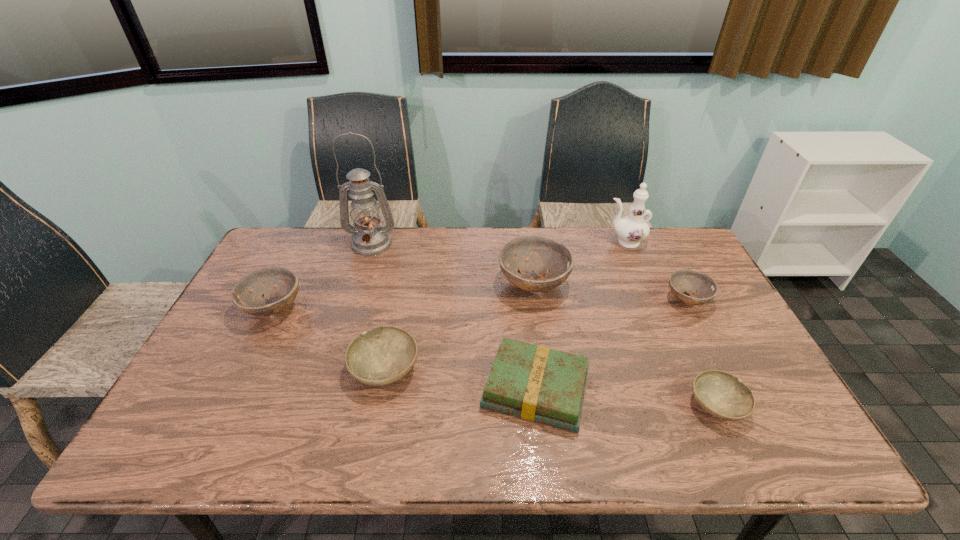
You are a GUI agent. You are given a task and a screenshot of the screen. Output one action in this format:
    pyautogui.click(x=<x>, y=<y>)
    Task: Click on the second closest brown bowl to the rightmost brown bowl
    
    Given the screenshot: What is the action you would take?
    pyautogui.click(x=246, y=294)

The height and width of the screenshot is (540, 960). Identify the location of brown bowl object that ranks as the second closest to the rightmost brown bowl. (246, 294).

Where is `vacant space that satisfies the following two spatial constraints: 1. on the back side of the shortest object; 2. at the spout of the seventh shortest object`? This screenshot has width=960, height=540. vacant space that satisfies the following two spatial constraints: 1. on the back side of the shortest object; 2. at the spout of the seventh shortest object is located at coordinates (641, 242).

The height and width of the screenshot is (540, 960). Identify the location of vacant area that satisfies the following two spatial constraints: 1. on the front side of the book; 2. on the left side of the leftmost brown bowl. (233, 389).

At what (x,y) coordinates should I click in order to perform the action: click on vacant space that satisfies the following two spatial constraints: 1. on the back side of the smallest brown bowl; 2. on the left side of the fourth bowl from right to left. Please return your answer as a coordinate pair (x, y). Image resolution: width=960 pixels, height=540 pixels. Looking at the image, I should click on (398, 300).

Where is `vacant space that satisfies the following two spatial constraints: 1. on the front side of the bigger gray bowl; 2. on the left side of the yellow book`? The height and width of the screenshot is (540, 960). vacant space that satisfies the following two spatial constraints: 1. on the front side of the bigger gray bowl; 2. on the left side of the yellow book is located at coordinates (381, 389).

Locate an element on the screen. The image size is (960, 540). free point that satisfies the following two spatial constraints: 1. at the spout of the chinaware; 2. on the right side of the rightmost brown bowl is located at coordinates (648, 300).

Locate an element on the screen. The width and height of the screenshot is (960, 540). vacant point that satisfies the following two spatial constraints: 1. on the front side of the oil lamp; 2. on the right side of the left gray bowl is located at coordinates (333, 369).

Where is `vacant point that satisfies the following two spatial constraints: 1. on the front side of the right gray bowl; 2. on the right side of the biggest brown bowl`? The width and height of the screenshot is (960, 540). vacant point that satisfies the following two spatial constraints: 1. on the front side of the right gray bowl; 2. on the right side of the biggest brown bowl is located at coordinates (550, 405).